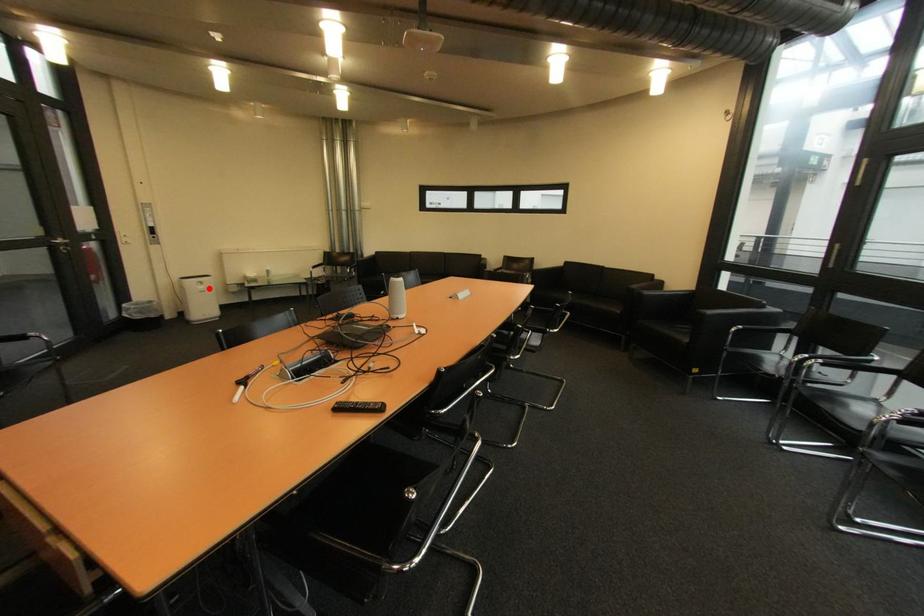
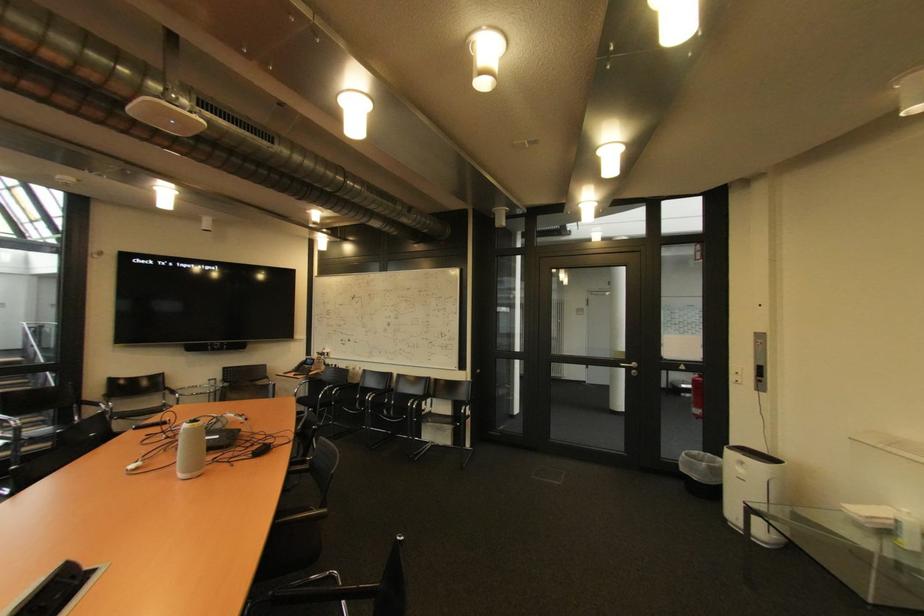
Question: A red point is marked in image1. In image2, is the corresponding 3D point closer to the camera or farther? Reply with the corresponding letter.

Choices:
 (A) The corresponding 3D point is closer.
 (B) The corresponding 3D point is farther.

Answer: (B)